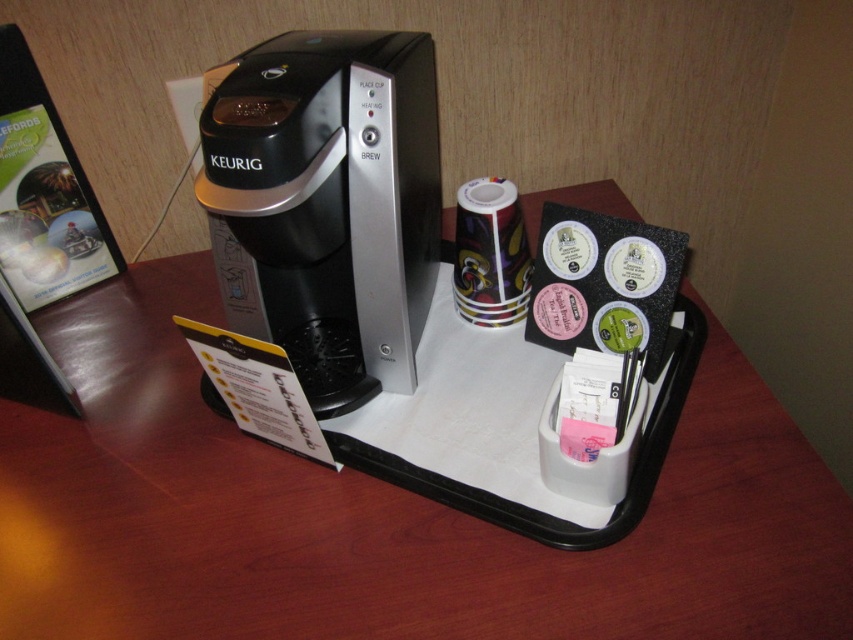
Is black plastic tray at center to the right of black plastic keurig at center from the viewer's perspective?

Correct, you'll find black plastic tray at center to the right of black plastic keurig at center.

At what (x,y) coordinates should I click in order to perform the action: click on black plastic tray at center. Please return your answer as a coordinate pair (x, y). Looking at the image, I should click on (379, 515).

Is point (100, 611) in front of point (380, 376)?

Yes, point (100, 611) is closer to viewer.

Where is `black plastic tray at center`? This screenshot has height=640, width=853. black plastic tray at center is located at coordinates click(x=379, y=515).